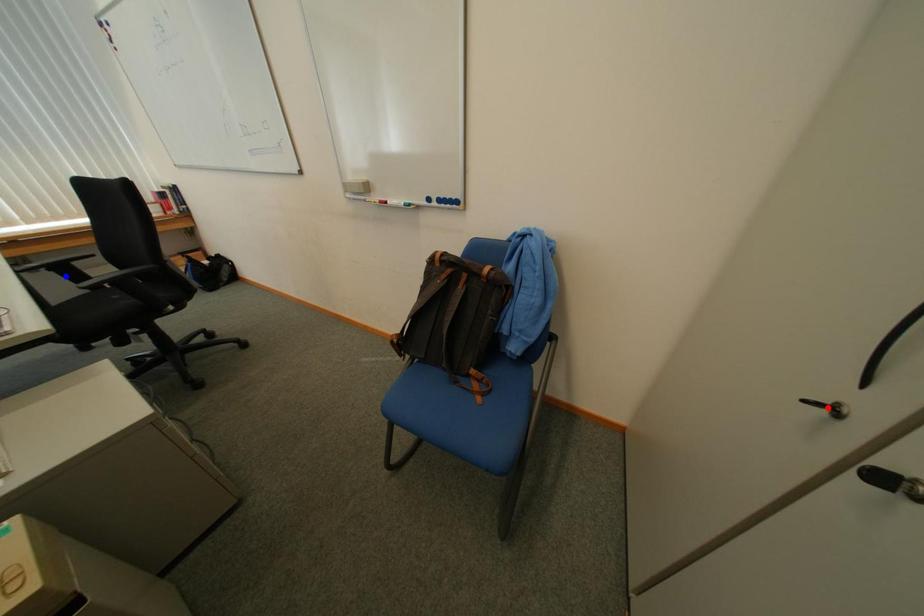
Question: Which of the two points in the image is closer to the camera?

Choices:
 (A) Blue point is closer.
 (B) Red point is closer.

Answer: (B)